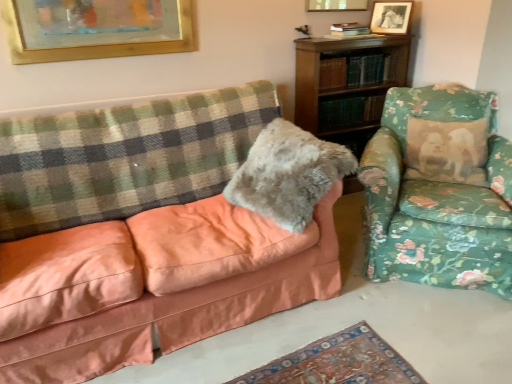
Question: Considering the relative positions of matte peach couch at left and floral fabric armchair at right in the image provided, is matte peach couch at left to the left or to the right of floral fabric armchair at right?

Choices:
 (A) right
 (B) left

Answer: (B)

Question: In the image, is matte peach couch at left positioned in front of or behind floral fabric armchair at right?

Choices:
 (A) front
 (B) behind

Answer: (A)

Question: Which object is the farthest from the fuzzy gray pillow at center?

Choices:
 (A) wooden picture frame at upper center, which appears as the second picture frame when viewed from the left
 (B) gold-framed picture at upper center, the 3th picture frame when ordered from right to left
 (C) matte peach couch at left
 (D) black glossy picture frame at upper right, placed as the 3th picture frame when sorted from left to right
 (E) green checkered blanket at left

Answer: (D)

Question: Based on their relative distances, which object is nearer to the green checkered blanket at left?

Choices:
 (A) gold-framed picture at upper center, the first picture frame in the left-to-right sequence
 (B) wooden bookshelf at upper right
 (C) wooden picture frame at upper center, which appears as the second picture frame when viewed from the left
 (D) black glossy picture frame at upper right, placed as the 1th picture frame when sorted from right to left
 (E) floral fabric armchair at right

Answer: (A)